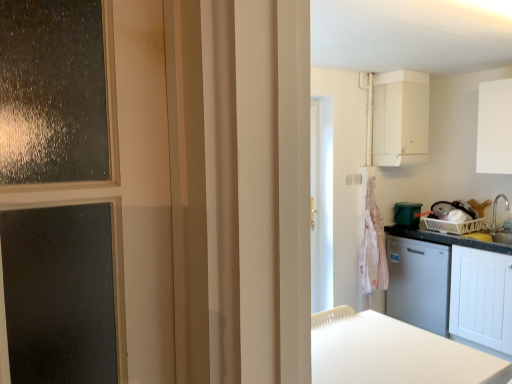
Question: From a real-world perspective, is pink striped fabric at right positioned over white matte cabinet at upper right, acting as the 3th cabinetry starting from the bottom, based on gravity?

Choices:
 (A) yes
 (B) no

Answer: (B)

Question: Is pink striped fabric at right aimed at white matte cabinet at upper right, which is the 1th cabinetry in top-to-bottom order?

Choices:
 (A) yes
 (B) no

Answer: (B)

Question: From the image's perspective, is pink striped fabric at right under white matte cabinet at upper right, acting as the 3th cabinetry starting from the bottom?

Choices:
 (A) no
 (B) yes

Answer: (B)

Question: Is pink striped fabric at right bigger than white matte cabinet at upper right, acting as the 3th cabinetry starting from the bottom?

Choices:
 (A) no
 (B) yes

Answer: (A)

Question: Is pink striped fabric at right directly adjacent to white matte cabinet at upper right, which is the 1th cabinetry in top-to-bottom order?

Choices:
 (A) no
 (B) yes

Answer: (A)

Question: Is satin silver faucet at right bigger or smaller than green plastic bucket at right?

Choices:
 (A) big
 (B) small

Answer: (B)

Question: From the image's perspective, relative to green plastic bucket at right, is satin silver faucet at right above or below?

Choices:
 (A) above
 (B) below

Answer: (A)

Question: In terms of height, does satin silver faucet at right look taller or shorter compared to green plastic bucket at right?

Choices:
 (A) tall
 (B) short

Answer: (A)

Question: From a real-world perspective, is satin silver faucet at right above or below green plastic bucket at right?

Choices:
 (A) below
 (B) above

Answer: (B)

Question: From a real-world perspective, relative to white matte table at lower center, is satin silver faucet at right vertically above or below?

Choices:
 (A) below
 (B) above

Answer: (B)

Question: From the image's perspective, relative to white matte table at lower center, is satin silver faucet at right above or below?

Choices:
 (A) above
 (B) below

Answer: (A)

Question: In terms of height, does satin silver faucet at right look taller or shorter compared to white matte table at lower center?

Choices:
 (A) short
 (B) tall

Answer: (B)

Question: Visually, is satin silver faucet at right positioned to the left or to the right of white matte table at lower center?

Choices:
 (A) left
 (B) right

Answer: (B)

Question: Is white matte cabinet at right, the 1th cabinetry ordered from the bottom, taller or shorter than white matte table at lower center?

Choices:
 (A) short
 (B) tall

Answer: (B)

Question: Looking at their shapes, would you say white matte cabinet at right, which is the 3th cabinetry in top-to-bottom order, is wider or thinner than white matte table at lower center?

Choices:
 (A) wide
 (B) thin

Answer: (A)